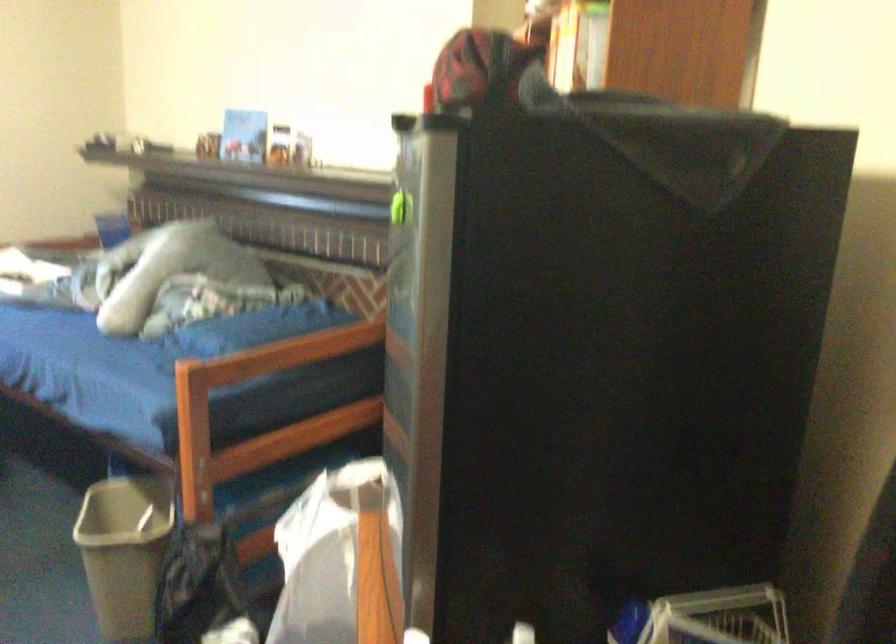
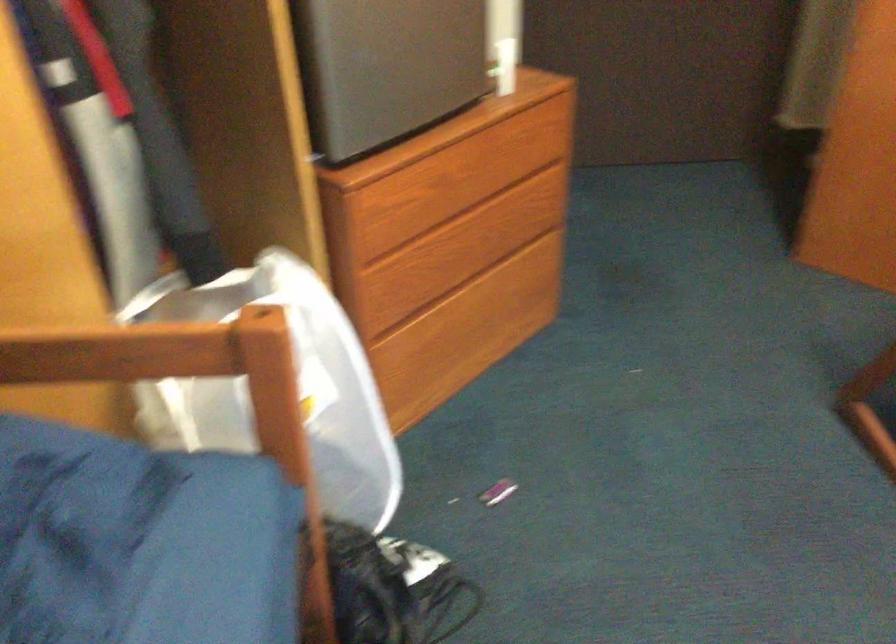
Locate, in the second image, the point that corresponds to point 194,401 in the first image.

(297, 386)